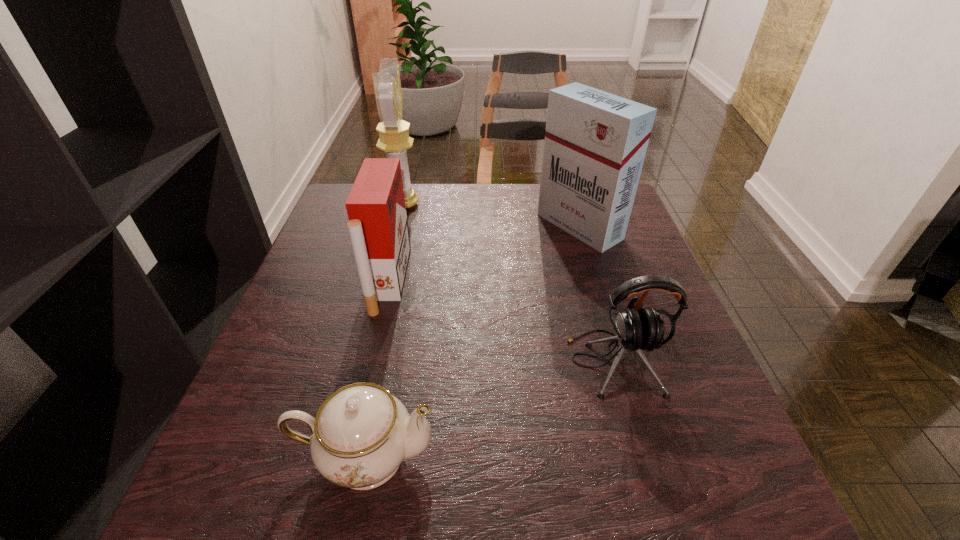
The image size is (960, 540). In order to click on vacant region that satisfies the following two spatial constraints: 1. on the front side of the right cigarette case; 2. on the front-facing side of the shorter cigarette case in this screenshot , I will do `click(595, 280)`.

The image size is (960, 540). Identify the location of free location that satisfies the following two spatial constraints: 1. on the front side of the earphone; 2. at the spout of the shortest object. (640, 456).

Image resolution: width=960 pixels, height=540 pixels. I want to click on vacant space that satisfies the following two spatial constraints: 1. on the front-facing side of the left cigarette case; 2. on the back side of the fourth farthest object, so click(x=370, y=362).

Locate an element on the screen. This screenshot has width=960, height=540. free location that satisfies the following two spatial constraints: 1. on the front-facing side of the award; 2. on the back side of the right cigarette case is located at coordinates (397, 226).

At what (x,y) coordinates should I click in order to perform the action: click on vacant area that satisfies the following two spatial constraints: 1. on the front-facing side of the left cigarette case; 2. on the right side of the fourth farthest object. Please return your answer as a coordinate pair (x, y). Image resolution: width=960 pixels, height=540 pixels. Looking at the image, I should click on (370, 362).

Image resolution: width=960 pixels, height=540 pixels. I want to click on vacant area that satisfies the following two spatial constraints: 1. on the front side of the earphone; 2. at the spout of the shortest object, so click(x=640, y=456).